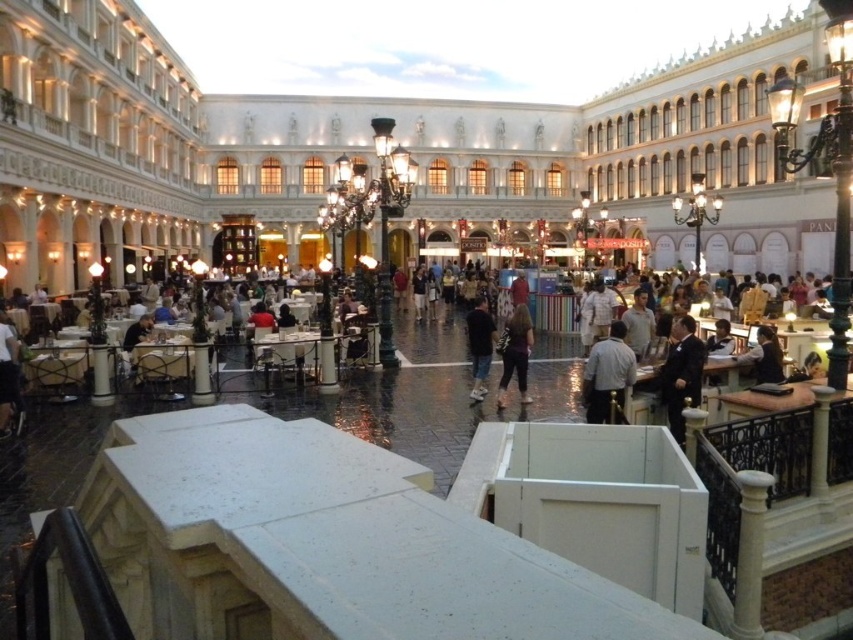
Does dark suit at center appear over black cotton shirt at center?

Actually, dark suit at center is below black cotton shirt at center.

Can you confirm if dark suit at center is positioned to the right of black cotton shirt at center?

Indeed, dark suit at center is positioned on the right side of black cotton shirt at center.

I want to click on dark suit at center, so click(682, 374).

Where is `dark suit at center`? dark suit at center is located at coordinates (682, 374).

Looking at this image, does black cotton shirt at center lie behind black leather jacket at center?

Yes, it is.

Is black cotton shirt at center thinner than black leather jacket at center?

Indeed, black cotton shirt at center has a lesser width compared to black leather jacket at center.

Between point (480, 340) and point (759, 330), which one is positioned in front?

Positioned in front is point (759, 330).

At what (x,y) coordinates should I click in order to perform the action: click on black cotton shirt at center. Please return your answer as a coordinate pair (x, y). Image resolution: width=853 pixels, height=640 pixels. Looking at the image, I should click on (480, 346).

Does dark suit at center have a greater height compared to light brown leather jacket at center?

Yes, dark suit at center is taller than light brown leather jacket at center.

Is point (699, 349) positioned before point (648, 339)?

Yes, it is.

Is point (700, 376) closer to camera compared to point (637, 316)?

Yes, point (700, 376) is in front of point (637, 316).

This screenshot has width=853, height=640. I want to click on dark suit at center, so click(682, 374).